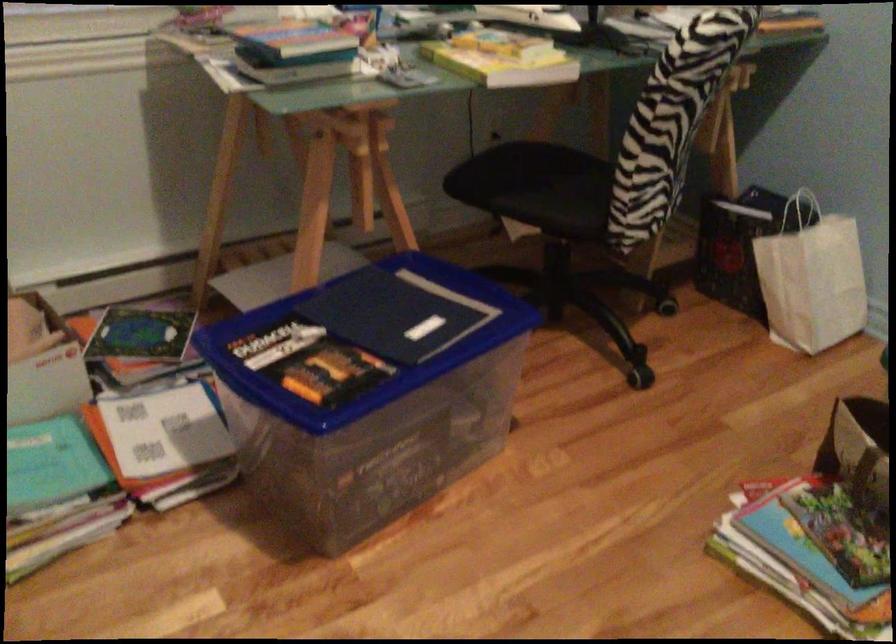
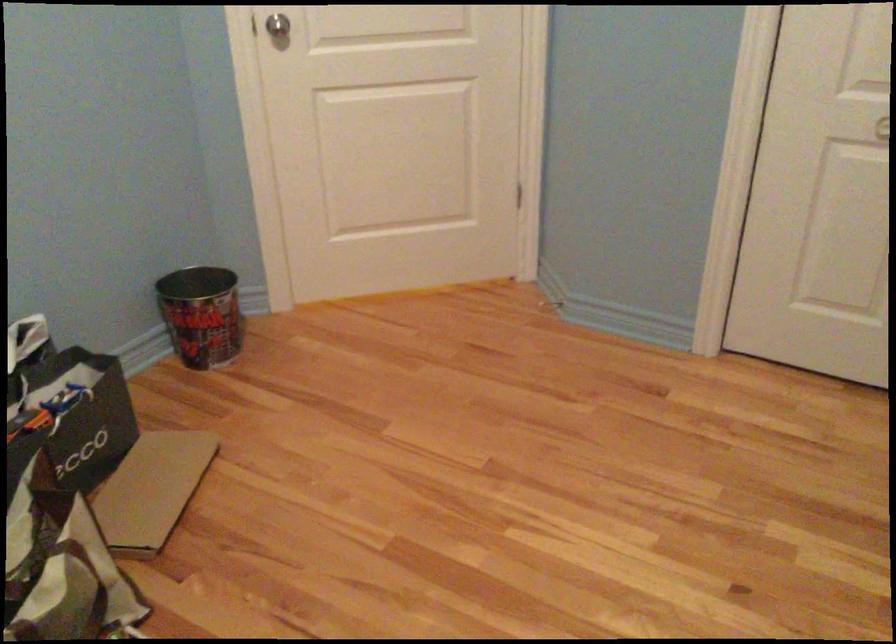
The first image is from the beginning of the video and the second image is from the end. How did the camera likely rotate when shooting the video?

The rotation direction of the camera is right-down.